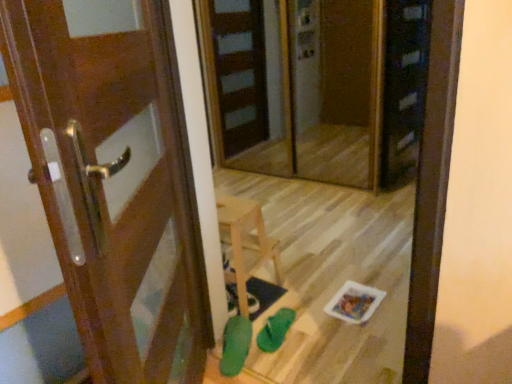
What are the coordinates of `free space to the right of green rubber shoe at lower center, the 2th shoe in the left-to-right sequence` in the screenshot? It's located at (315, 326).